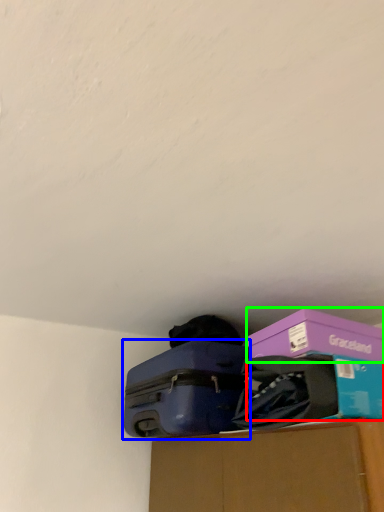
Question: Considering the real-world distances, which object is farthest from storage box (highlighted by a red box)? suitcase (highlighted by a blue box) or box (highlighted by a green box)?

Choices:
 (A) suitcase
 (B) box

Answer: (A)